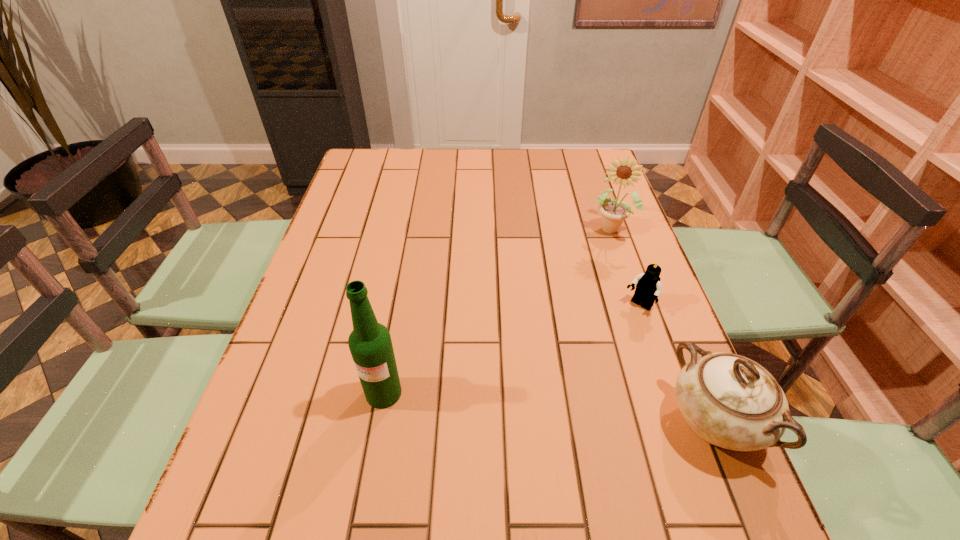
Identify the location of free point located on the front-facing side of the sunflower. The image size is (960, 540). (566, 349).

In order to click on vacant space positioned 0.350m on the front-facing side of the sunflower in this screenshot , I will do `click(573, 333)`.

This screenshot has height=540, width=960. I want to click on vacant space located on the front-facing side of the shortest object, so click(545, 408).

The width and height of the screenshot is (960, 540). What are the coordinates of `free space located on the front-facing side of the shortest object` in the screenshot? It's located at (557, 395).

Image resolution: width=960 pixels, height=540 pixels. Find the location of `vacant space positioned 0.100m on the front-facing side of the shortest object`. vacant space positioned 0.100m on the front-facing side of the shortest object is located at coordinates (610, 339).

Where is `object present at the near edge`? Image resolution: width=960 pixels, height=540 pixels. object present at the near edge is located at coordinates (728, 400).

At what (x,y) coordinates should I click in order to perform the action: click on chinaware at the right edge. Please return your answer as a coordinate pair (x, y). This screenshot has width=960, height=540. Looking at the image, I should click on (728, 400).

Image resolution: width=960 pixels, height=540 pixels. I want to click on sunflower at the right edge, so (613, 212).

In order to click on Lego located in the right edge section of the desktop in this screenshot , I will do `click(648, 286)`.

At what (x,y) coordinates should I click in order to perform the action: click on object positioned at the near right corner. Please return your answer as a coordinate pair (x, y). This screenshot has height=540, width=960. Looking at the image, I should click on (728, 400).